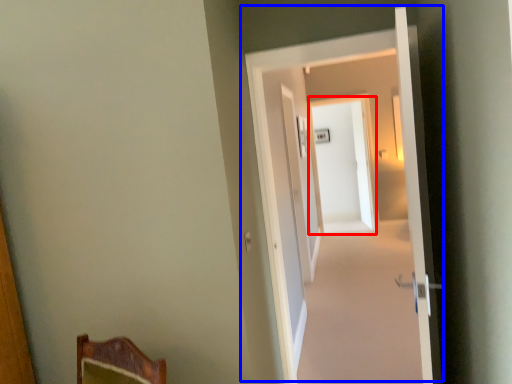
Question: Which point is closer to the camera, screen door (highlighted by a red box) or door (highlighted by a blue box)?

Choices:
 (A) screen door
 (B) door

Answer: (B)